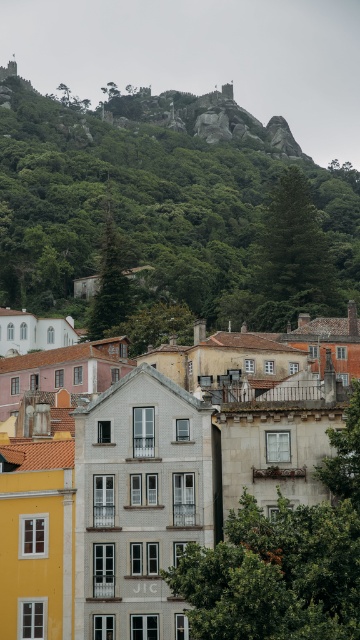
Question: Considering the relative positions of white tile building at center and green leafy hillside at upper center in the image provided, where is white tile building at center located with respect to green leafy hillside at upper center?

Choices:
 (A) left
 (B) right

Answer: (A)

Question: Which of the following is the farthest from the observer?

Choices:
 (A) white tile building at center
 (B) green leafy hillside at upper center

Answer: (B)

Question: Among these points, which one is nearest to the camera?

Choices:
 (A) (227, 112)
 (B) (239, 492)

Answer: (B)

Question: Can you confirm if white tile building at center is positioned to the left of green leafy hillside at upper center?

Choices:
 (A) no
 (B) yes

Answer: (B)

Question: Is white tile building at center below green leafy hillside at upper center?

Choices:
 (A) no
 (B) yes

Answer: (B)